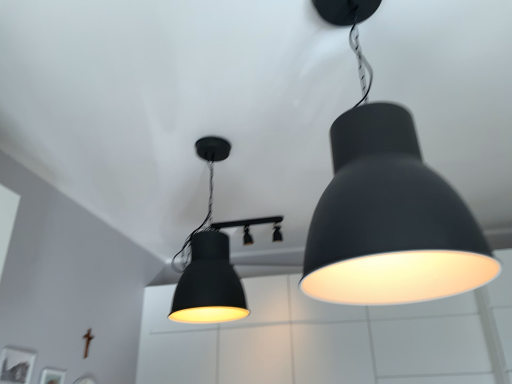
Question: From a real-world perspective, is matte black lampshade at upper right, the third lamp positioned from the back, below matte black light fixture at center, marked as the 1th lamp in a back-to-front arrangement?

Choices:
 (A) yes
 (B) no

Answer: (A)

Question: Is matte black lampshade at upper right, the third lamp positioned from the back, next to matte black light fixture at center, marked as the 1th lamp in a back-to-front arrangement, and touching it?

Choices:
 (A) no
 (B) yes

Answer: (A)

Question: Is matte black lampshade at upper right, the third lamp positioned from the back, further to the viewer compared to matte black light fixture at center, the third lamp in the front-to-back sequence?

Choices:
 (A) no
 (B) yes

Answer: (A)

Question: Does matte black lampshade at upper right, which ranks as the first lamp in front-to-back order, have a smaller size compared to matte black light fixture at center, the third lamp in the front-to-back sequence?

Choices:
 (A) yes
 (B) no

Answer: (B)

Question: Is there a large distance between matte black lampshade at upper right, which ranks as the first lamp in front-to-back order, and matte black light fixture at center, marked as the 1th lamp in a back-to-front arrangement?

Choices:
 (A) yes
 (B) no

Answer: (A)

Question: From the image's perspective, is matte black lampshade at upper right, the third lamp positioned from the back, above matte black light fixture at center, marked as the 1th lamp in a back-to-front arrangement?

Choices:
 (A) yes
 (B) no

Answer: (A)

Question: From the image's perspective, is matte black lampshade at center, the 2th lamp when ordered from back to front, beneath matte black light fixture at center, marked as the 1th lamp in a back-to-front arrangement?

Choices:
 (A) yes
 (B) no

Answer: (B)

Question: Does matte black lampshade at center, acting as the 2th lamp starting from the front, have a lesser width compared to matte black light fixture at center, the third lamp in the front-to-back sequence?

Choices:
 (A) no
 (B) yes

Answer: (B)

Question: Considering the relative positions of matte black lampshade at center, the 2th lamp when ordered from back to front, and matte black light fixture at center, marked as the 1th lamp in a back-to-front arrangement, in the image provided, is matte black lampshade at center, the 2th lamp when ordered from back to front, to the left of matte black light fixture at center, marked as the 1th lamp in a back-to-front arrangement, from the viewer's perspective?

Choices:
 (A) yes
 (B) no

Answer: (A)

Question: Is matte black light fixture at center, the third lamp in the front-to-back sequence, at the back of matte black lampshade at center, the 2th lamp when ordered from back to front?

Choices:
 (A) yes
 (B) no

Answer: (B)

Question: Would you say matte black lampshade at center, the 2th lamp when ordered from back to front, is a long distance from matte black light fixture at center, marked as the 1th lamp in a back-to-front arrangement?

Choices:
 (A) no
 (B) yes

Answer: (B)

Question: Can you confirm if matte black lampshade at center, acting as the 2th lamp starting from the front, is positioned to the right of matte black light fixture at center, marked as the 1th lamp in a back-to-front arrangement?

Choices:
 (A) yes
 (B) no

Answer: (B)

Question: Can you confirm if matte black light fixture at center, the third lamp in the front-to-back sequence, is bigger than matte black lampshade at upper right, the third lamp positioned from the back?

Choices:
 (A) no
 (B) yes

Answer: (A)